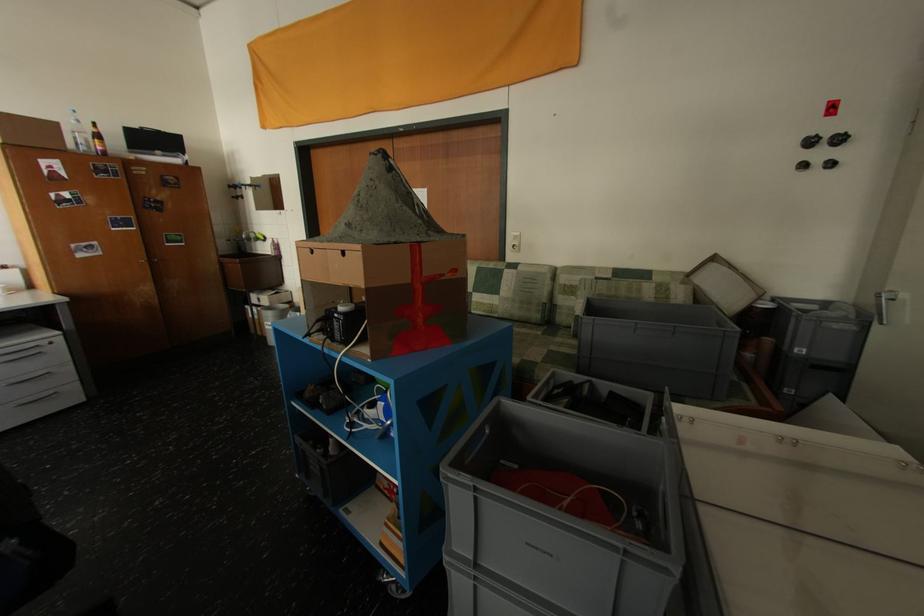
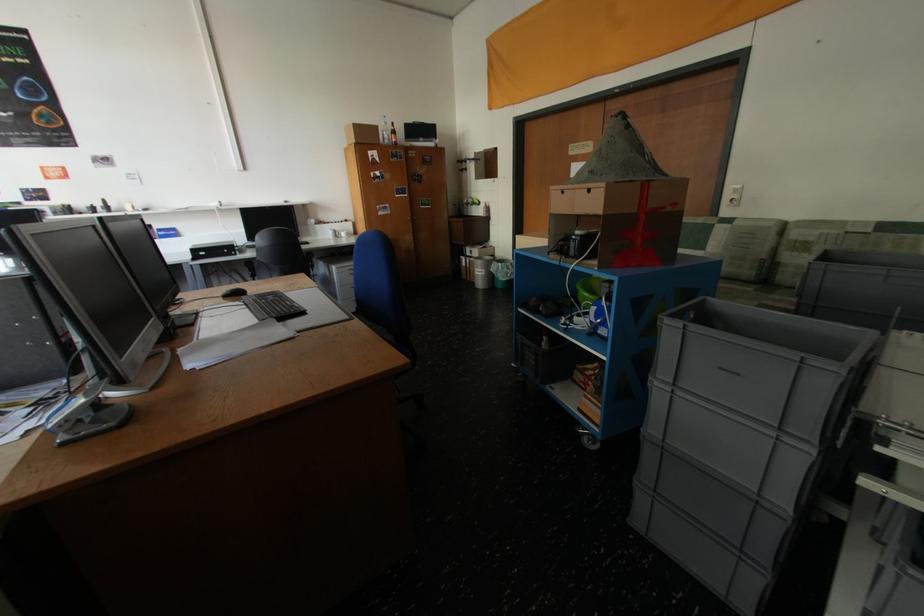
In the second image, find the point that corresponds to point 390,546 in the first image.

(588, 411)